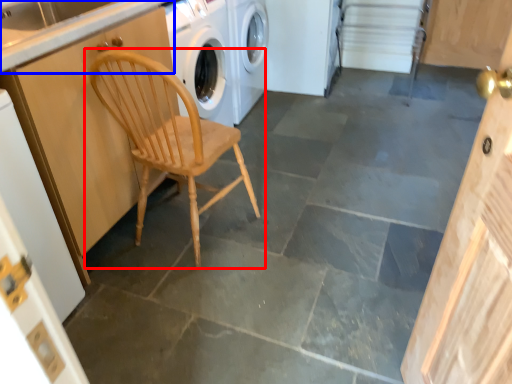
Question: Which object appears farthest to the camera in this image, chair (highlighted by a red box) or counter top (highlighted by a blue box)?

Choices:
 (A) chair
 (B) counter top

Answer: (B)